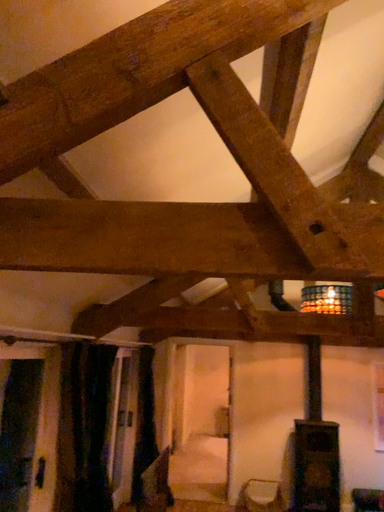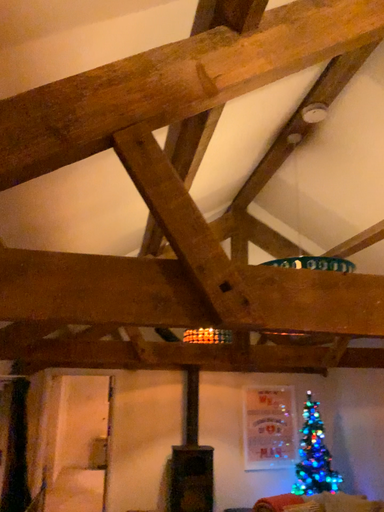
Question: How did the camera likely rotate when shooting the video?

Choices:
 (A) rotated left
 (B) rotated right

Answer: (B)